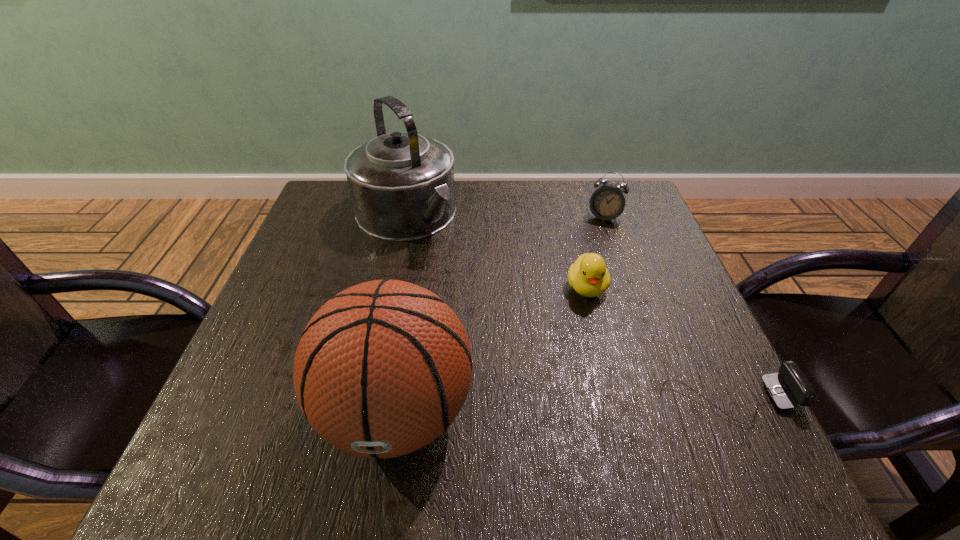
Find the location of a particular element. free space that satisfies the following two spatial constraints: 1. on the front side of the shortest object; 2. on the front-facing side of the kettle is located at coordinates (366, 400).

I want to click on vacant point that satisfies the following two spatial constraints: 1. on the front side of the alarm clock; 2. on the front-facing side of the shortest object, so click(668, 400).

Locate an element on the screen. vacant position in the image that satisfies the following two spatial constraints: 1. on the front side of the kettle; 2. on the front-facing side of the webcam is located at coordinates (366, 400).

Where is `free space that satisfies the following two spatial constraints: 1. on the front side of the shortest object; 2. on the front-facing side of the third shortest object`? free space that satisfies the following two spatial constraints: 1. on the front side of the shortest object; 2. on the front-facing side of the third shortest object is located at coordinates (668, 400).

Identify the location of vacant area in the image that satisfies the following two spatial constraints: 1. on the front side of the third shortest object; 2. on the left side of the kettle. The height and width of the screenshot is (540, 960). (405, 218).